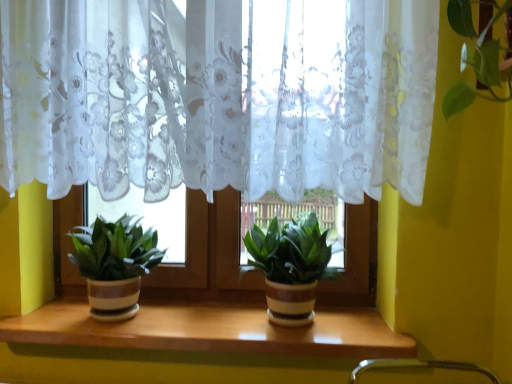
Question: Considering the relative sizes of green matte plant pot at center, positioned as the 2th houseplant in left-to-right order, and wooden at center in the image provided, is green matte plant pot at center, positioned as the 2th houseplant in left-to-right order, shorter than wooden at center?

Choices:
 (A) no
 (B) yes

Answer: (A)

Question: From a real-world perspective, is green matte plant pot at center, the first houseplant in the right-to-left sequence, beneath wooden at center?

Choices:
 (A) no
 (B) yes

Answer: (A)

Question: Considering the relative sizes of green matte plant pot at center, positioned as the 2th houseplant in left-to-right order, and wooden at center in the image provided, is green matte plant pot at center, positioned as the 2th houseplant in left-to-right order, bigger than wooden at center?

Choices:
 (A) no
 (B) yes

Answer: (B)

Question: Is green matte plant pot at center, the first houseplant in the right-to-left sequence, aimed at wooden at center?

Choices:
 (A) yes
 (B) no

Answer: (B)

Question: Is green matte plant pot at center, positioned as the 2th houseplant in left-to-right order, wider than wooden at center?

Choices:
 (A) yes
 (B) no

Answer: (B)

Question: Is green matte plant pot at center, positioned as the 2th houseplant in left-to-right order, at the right side of wooden at center?

Choices:
 (A) no
 (B) yes

Answer: (B)

Question: Can you confirm if green matte plant pot at left, the first houseplant positioned from the left, is smaller than green matte plant pot at center, positioned as the 2th houseplant in left-to-right order?

Choices:
 (A) no
 (B) yes

Answer: (B)

Question: Could you tell me if green matte plant pot at left, the first houseplant positioned from the left, is turned towards green matte plant pot at center, positioned as the 2th houseplant in left-to-right order?

Choices:
 (A) yes
 (B) no

Answer: (B)

Question: Can you confirm if green matte plant pot at left, the first houseplant positioned from the left, is positioned to the left of green matte plant pot at center, the first houseplant in the right-to-left sequence?

Choices:
 (A) yes
 (B) no

Answer: (A)

Question: Can you confirm if green matte plant pot at left, the first houseplant positioned from the left, is wider than green matte plant pot at center, the first houseplant in the right-to-left sequence?

Choices:
 (A) no
 (B) yes

Answer: (B)

Question: Is green matte plant pot at left, which is the second houseplant in right-to-left order, placed right next to green matte plant pot at center, the first houseplant in the right-to-left sequence?

Choices:
 (A) no
 (B) yes

Answer: (A)

Question: From a real-world perspective, is green matte plant pot at left, which is the second houseplant in right-to-left order, on top of green matte plant pot at center, the first houseplant in the right-to-left sequence?

Choices:
 (A) yes
 (B) no

Answer: (A)

Question: Is green matte plant pot at center, positioned as the 2th houseplant in left-to-right order, oriented away from green matte plant pot at left, which is the second houseplant in right-to-left order?

Choices:
 (A) yes
 (B) no

Answer: (B)